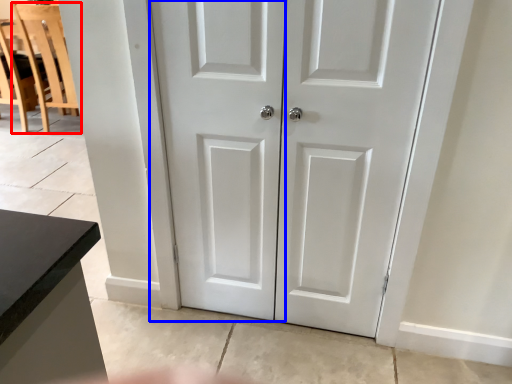
Question: Which object is closer to the camera taking this photo, chair (highlighted by a red box) or screen door (highlighted by a blue box)?

Choices:
 (A) chair
 (B) screen door

Answer: (B)